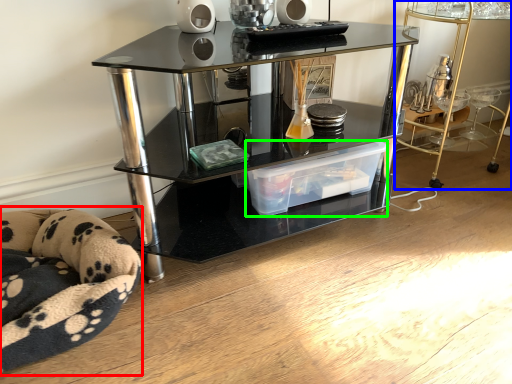
Question: Which object is the closest to the swivel chair (highlighted by a red box)? Choose among these: table (highlighted by a blue box) or storage box (highlighted by a green box).

Choices:
 (A) table
 (B) storage box

Answer: (B)